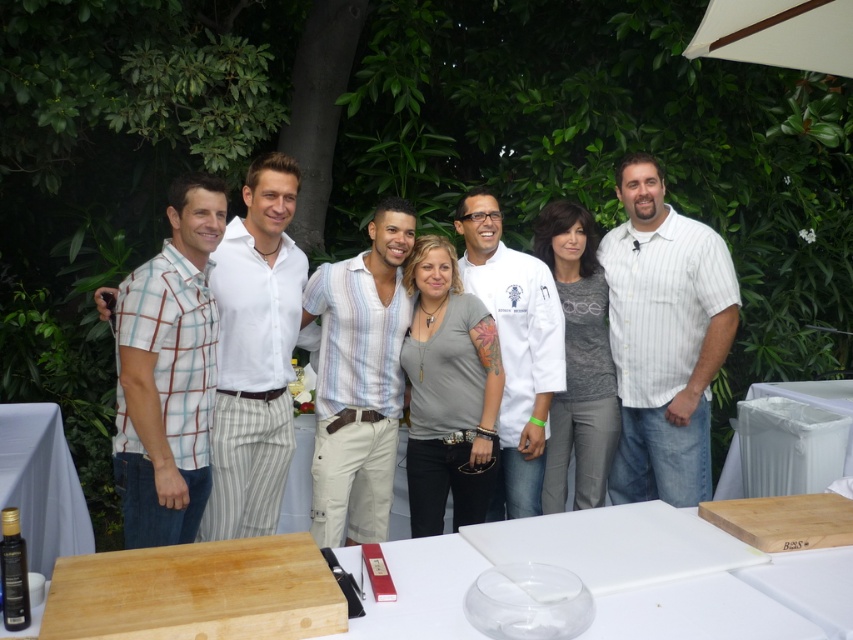
Question: Is white chef coat at center wider than black glass bottle at lower left?

Choices:
 (A) yes
 (B) no

Answer: (B)

Question: Which of the following is the farthest from the observer?

Choices:
 (A) black glass bottle at lower left
 (B) gray cotton shirt at center

Answer: (B)

Question: Which object is farther from the camera taking this photo?

Choices:
 (A) white striped shirt at center
 (B) white cotton shirt at center
 (C) wooden cutting board at lower center
 (D) gray cotton shirt at center

Answer: (D)

Question: Which point appears farthest from the camera in this image?

Choices:
 (A) (257, 532)
 (B) (596, 428)

Answer: (B)

Question: Considering the relative positions of gray matte shirt at center and black glass bottle at lower left in the image provided, where is gray matte shirt at center located with respect to black glass bottle at lower left?

Choices:
 (A) left
 (B) right

Answer: (B)

Question: Where is striped cotton shirt at center located in relation to black glass bottle at lower left in the image?

Choices:
 (A) right
 (B) left

Answer: (A)